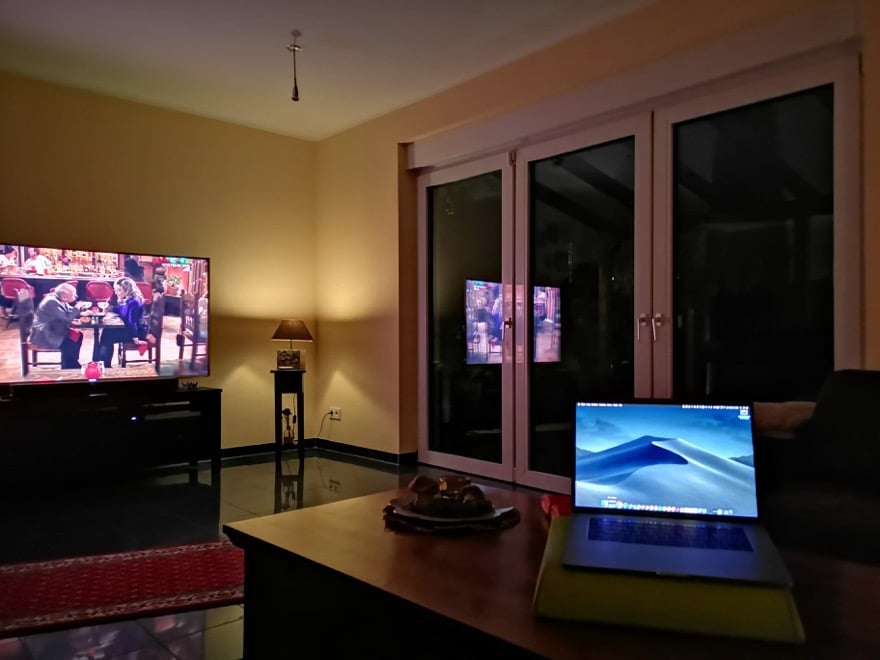
Identify the location of table. The width and height of the screenshot is (880, 660). (167, 475).